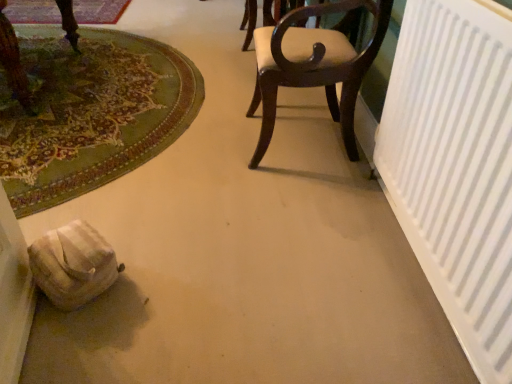
The width and height of the screenshot is (512, 384). What do you see at coordinates (314, 63) in the screenshot?
I see `dark wood chair at center` at bounding box center [314, 63].

In order to click on carpeted mat at upper left, positioned as the 1th mat in back-to-front order in this screenshot , I will do `click(32, 12)`.

This screenshot has height=384, width=512. Describe the element at coordinates (32, 12) in the screenshot. I see `carpeted mat at upper left, the second mat from the front` at that location.

Where is `white matte radiator at right`? This screenshot has height=384, width=512. white matte radiator at right is located at coordinates (456, 166).

Can you confirm if carpeted mat at upper left, positioned as the 1th mat in back-to-front order, is positioned to the right of white matte radiator at right?

No.

Is carpeted mat at upper left, which is the second mat in bottom-to-top order, placed right next to white matte radiator at right?

carpeted mat at upper left, which is the second mat in bottom-to-top order, is not next to white matte radiator at right, and they're not touching.

Considering the relative sizes of carpeted mat at upper left, the first mat when ordered from top to bottom, and white matte radiator at right in the image provided, is carpeted mat at upper left, the first mat when ordered from top to bottom, shorter than white matte radiator at right?

Yes.

From a real-world perspective, which mat is the 2nd one underneath the white matte radiator at right? Please provide its 2D coordinates.

[(32, 12)]

Which object is further away from the camera, carpeted mat at upper left, positioned as the 1th mat in back-to-front order, or green carpet at lower left, the second mat from the top?

carpeted mat at upper left, positioned as the 1th mat in back-to-front order.

Are carpeted mat at upper left, the first mat when ordered from top to bottom, and green carpet at lower left, the second mat positioned from the back, making contact?

No, carpeted mat at upper left, the first mat when ordered from top to bottom, is not with green carpet at lower left, the second mat positioned from the back.

Between point (84, 0) and point (149, 127), which one is positioned behind?

Point (84, 0)

This screenshot has width=512, height=384. What are the coordinates of `mat in front of the carpeted mat at upper left, positioned as the 1th mat in back-to-front order` in the screenshot? It's located at (91, 113).

From the image's perspective, between dark wood chair at center and white matte radiator at right, who is located below?

white matte radiator at right.

How different are the orientations of dark wood chair at center and white matte radiator at right in degrees?

The angular difference between dark wood chair at center and white matte radiator at right is 0.746 degrees.

Does dark wood chair at center come in front of white matte radiator at right?

No, dark wood chair at center is further to the viewer.

Identify the location of chair that appears below the white matte radiator at right (from a real-world perspective). (314, 63).

Measure the distance between green carpet at lower left, the second mat positioned from the back, and dark wood chair at center.

A distance of 36.55 inches exists between green carpet at lower left, the second mat positioned from the back, and dark wood chair at center.

Considering the positions of objects green carpet at lower left, the second mat positioned from the back, and dark wood chair at center in the image provided, who is more to the left, green carpet at lower left, the second mat positioned from the back, or dark wood chair at center?

green carpet at lower left, the second mat positioned from the back.

From the picture: Is green carpet at lower left, the second mat from the top, completely or partially outside of dark wood chair at center?

green carpet at lower left, the second mat from the top, is positioned outside dark wood chair at center.

Relative to carpeted mat at upper left, which is the second mat in bottom-to-top order, is white matte radiator at right in front or behind?

Clearly, white matte radiator at right is in front of carpeted mat at upper left, which is the second mat in bottom-to-top order.

Based on the photo, can you confirm if white matte radiator at right is bigger than carpeted mat at upper left, which is the second mat in bottom-to-top order?

Indeed, white matte radiator at right has a larger size compared to carpeted mat at upper left, which is the second mat in bottom-to-top order.

From the image's perspective, is white matte radiator at right below carpeted mat at upper left, positioned as the 1th mat in back-to-front order?

Correct, white matte radiator at right appears lower than carpeted mat at upper left, positioned as the 1th mat in back-to-front order, in the image.

Considering the positions of point (465, 13) and point (24, 11), is point (465, 13) closer or farther from the camera than point (24, 11)?

Point (465, 13) is closer to the camera than point (24, 11).

Is dark wood chair at center turned away from carpeted mat at upper left, which is the second mat in bottom-to-top order?

No, dark wood chair at center's orientation is not away from carpeted mat at upper left, which is the second mat in bottom-to-top order.

Would you say dark wood chair at center is outside carpeted mat at upper left, the second mat from the front?

That's correct, dark wood chair at center is outside of carpeted mat at upper left, the second mat from the front.

Locate an element on the screen. chair that appears above the carpeted mat at upper left, which is the second mat in bottom-to-top order (from a real-world perspective) is located at coordinates (314, 63).

Considering the sizes of objects dark wood chair at center and carpeted mat at upper left, the second mat from the front, in the image provided, who is thinner, dark wood chair at center or carpeted mat at upper left, the second mat from the front,?

dark wood chair at center is thinner.

In the scene shown: Are white matte radiator at right and green carpet at lower left, which is the first mat in front-to-back order, making contact?

No.

Can you confirm if white matte radiator at right is thinner than green carpet at lower left, positioned as the 1th mat in bottom-to-top order?

Yes.

Is white matte radiator at right looking in the opposite direction of green carpet at lower left, which is the first mat in front-to-back order?

white matte radiator at right is not turned away from green carpet at lower left, which is the first mat in front-to-back order.

I want to click on radiator below the carpeted mat at upper left, which is the second mat in bottom-to-top order (from the image's perspective), so click(456, 166).

In the image, there is a green carpet at lower left, which is the first mat in front-to-back order. Identify the location of mat above it (from the image's perspective). The image size is (512, 384). (32, 12).

Based on their spatial positions, is carpeted mat at upper left, the second mat from the front, or dark wood chair at center closer to green carpet at lower left, which is the first mat in front-to-back order?

dark wood chair at center is closer to green carpet at lower left, which is the first mat in front-to-back order.

Based on the photo, from the image, which object appears to be farther from white matte radiator at right, carpeted mat at upper left, the first mat when ordered from top to bottom, or dark wood chair at center?

carpeted mat at upper left, the first mat when ordered from top to bottom, is further to white matte radiator at right.

Looking at this image, from the image, which object appears to be nearer to white matte radiator at right, dark wood chair at center or green carpet at lower left, the second mat from the top?

Among the two, dark wood chair at center is located nearer to white matte radiator at right.

Estimate the real-world distances between objects in this image. Which object is closer to green carpet at lower left, the second mat positioned from the back, dark wood chair at center or carpeted mat at upper left, positioned as the 1th mat in back-to-front order?

dark wood chair at center is positioned closer to the anchor green carpet at lower left, the second mat positioned from the back.

Considering their positions, is carpeted mat at upper left, which is the second mat in bottom-to-top order, positioned closer to dark wood chair at center than green carpet at lower left, positioned as the 1th mat in bottom-to-top order?

Among the two, green carpet at lower left, positioned as the 1th mat in bottom-to-top order, is located nearer to dark wood chair at center.

When comparing their distances from white matte radiator at right, does green carpet at lower left, the second mat from the top, or carpeted mat at upper left, which is the second mat in bottom-to-top order, seem further?

Based on the image, carpeted mat at upper left, which is the second mat in bottom-to-top order, appears to be further to white matte radiator at right.

Considering their positions, is green carpet at lower left, the second mat from the top, positioned closer to carpeted mat at upper left, positioned as the 1th mat in back-to-front order, than dark wood chair at center?

Based on the image, green carpet at lower left, the second mat from the top, appears to be nearer to carpeted mat at upper left, positioned as the 1th mat in back-to-front order.

Based on their spatial positions, is dark wood chair at center or white matte radiator at right further from carpeted mat at upper left, the second mat from the front?

The object further to carpeted mat at upper left, the second mat from the front, is white matte radiator at right.

Locate an element on the screen. The width and height of the screenshot is (512, 384). chair between green carpet at lower left, the second mat from the top, and carpeted mat at upper left, the second mat from the front, from front to back is located at coordinates (314, 63).

Locate an element on the screen. This screenshot has height=384, width=512. mat positioned between white matte radiator at right and carpeted mat at upper left, the first mat when ordered from top to bottom, from near to far is located at coordinates (91, 113).

I want to click on chair between white matte radiator at right and carpeted mat at upper left, the second mat from the front, along the z-axis, so click(x=314, y=63).

What are the coordinates of `chair situated between green carpet at lower left, positioned as the 1th mat in bottom-to-top order, and white matte radiator at right from left to right` in the screenshot? It's located at (314, 63).